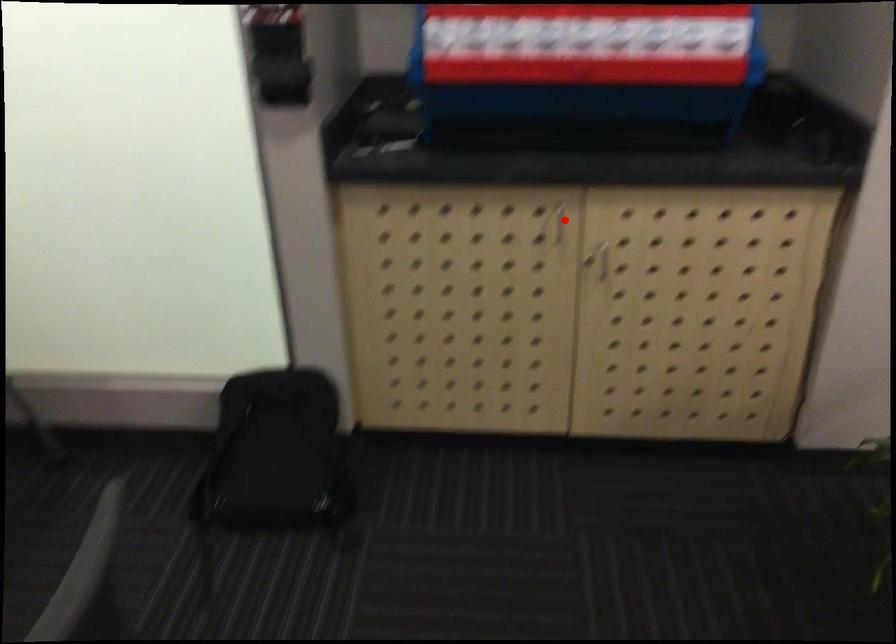
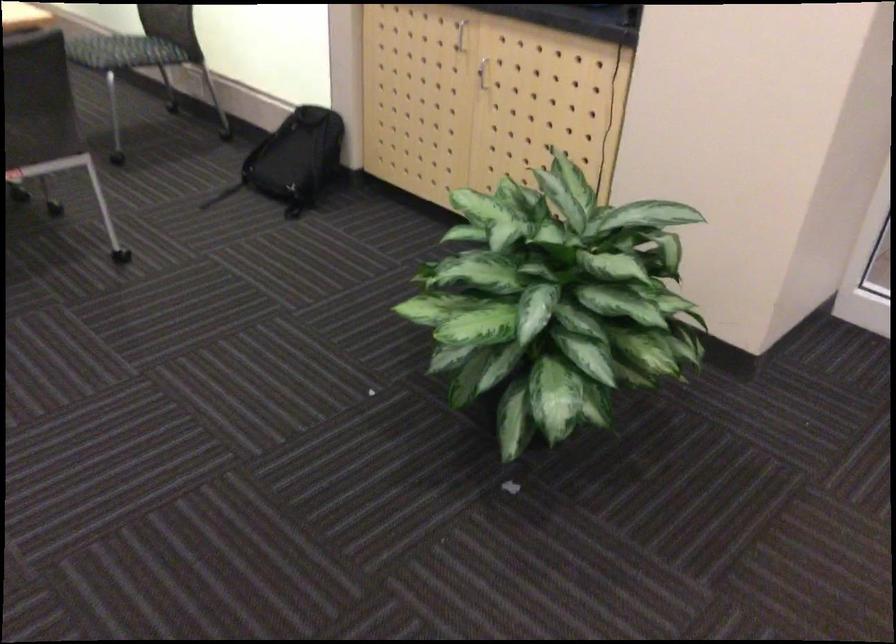
Question: I am providing you with two images of the same scene from different viewpoints. Image1 has a red point marked. In image2, the corresponding 3D location appears at what relative position? Reply with the corresponding letter.

Choices:
 (A) Closer
 (B) Farther

Answer: (B)